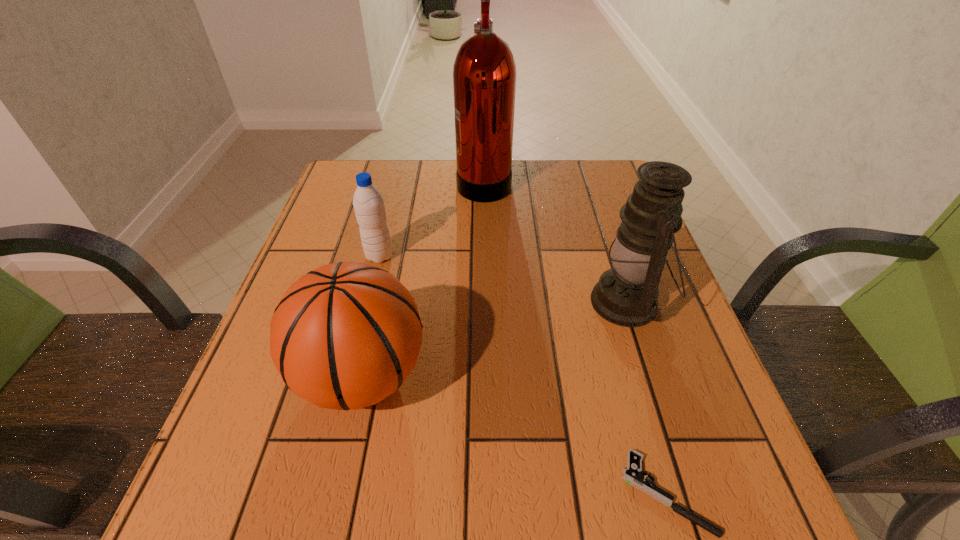
Locate an element on the screen. This screenshot has width=960, height=540. vacant position located on the left of the second tallest object is located at coordinates (485, 302).

Where is `free space located 0.050m on the left of the basketball`? Image resolution: width=960 pixels, height=540 pixels. free space located 0.050m on the left of the basketball is located at coordinates (269, 376).

Where is `free space located on the right of the water bottle`? free space located on the right of the water bottle is located at coordinates (428, 256).

This screenshot has width=960, height=540. Identify the location of vacant space located on the front-facing side of the pistol. (370, 493).

Where is `free space located on the front-facing side of the pistol`? The height and width of the screenshot is (540, 960). free space located on the front-facing side of the pistol is located at coordinates (466, 493).

At what (x,y) coordinates should I click in order to perform the action: click on free space located on the front-facing side of the pistol. Please return your answer as a coordinate pair (x, y). Looking at the image, I should click on (528, 493).

Identify the location of object at the far edge. The image size is (960, 540). (484, 72).

Where is `object at the near edge`? This screenshot has width=960, height=540. object at the near edge is located at coordinates (632, 475).

Image resolution: width=960 pixels, height=540 pixels. Find the location of `basketball present at the left edge`. basketball present at the left edge is located at coordinates (346, 335).

At what (x,y) coordinates should I click in order to perform the action: click on water bottle that is at the left edge. Please return your answer as a coordinate pair (x, y). The height and width of the screenshot is (540, 960). Looking at the image, I should click on (368, 203).